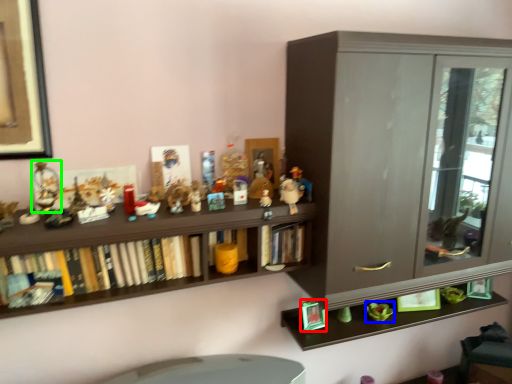
Question: Which object is the farthest from toy (highlighted by a red box)? Choose among these: toy (highlighted by a blue box) or toy (highlighted by a green box).

Choices:
 (A) toy
 (B) toy

Answer: (B)